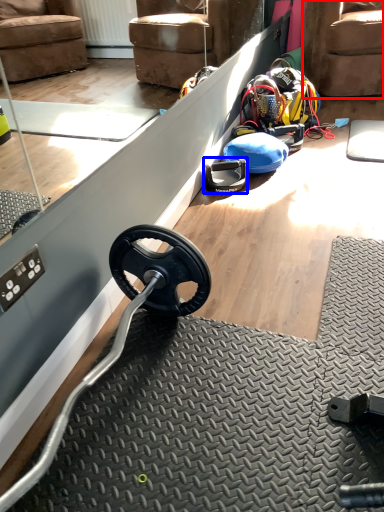
Question: Which object appears closest to the camera in this image, armchair (highlighted by a red box) or wheel (highlighted by a blue box)?

Choices:
 (A) armchair
 (B) wheel

Answer: (B)